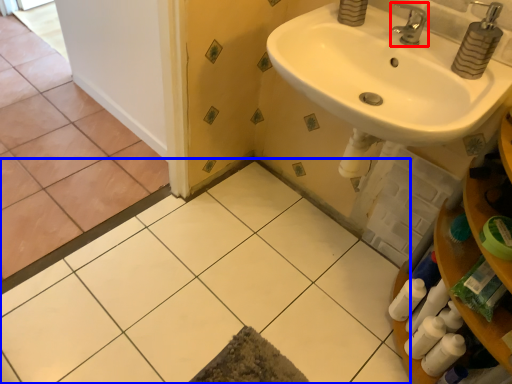
Question: Which object appears closest to the camera in this image, tap (highlighted by a red box) or ceramic tile (highlighted by a blue box)?

Choices:
 (A) tap
 (B) ceramic tile

Answer: (B)